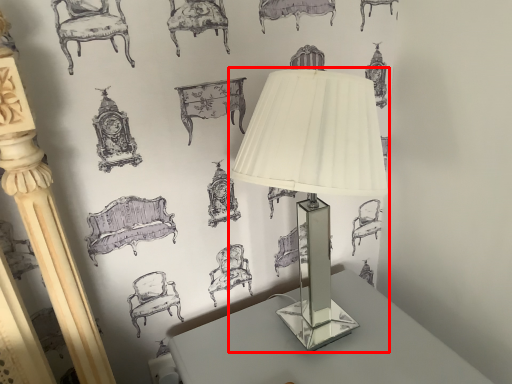
Question: From the image's perspective, where is lamp (annotated by the red box) located relative to table?

Choices:
 (A) above
 (B) below

Answer: (A)